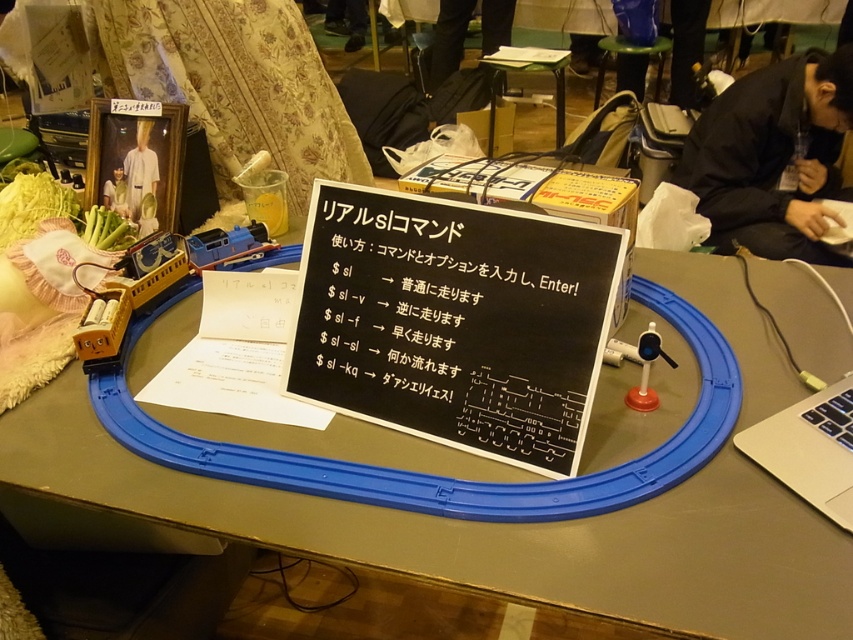
Does white fabric at center appear on the right side of matte white shirt at upper left?

Yes, white fabric at center is to the right of matte white shirt at upper left.

What do you see at coordinates (140, 172) in the screenshot? I see `white fabric at center` at bounding box center [140, 172].

The width and height of the screenshot is (853, 640). What do you see at coordinates (140, 172) in the screenshot? I see `white fabric at center` at bounding box center [140, 172].

The image size is (853, 640). I want to click on white fabric at center, so click(x=140, y=172).

Does black fabric at upper right come behind black pants at upper center?

No, it is not.

Find the location of a particular element. The image size is (853, 640). black fabric at upper right is located at coordinates (773, 156).

I want to click on black fabric at upper right, so click(773, 156).

Can you confirm if black pants at upper center is thinner than matte white shirt at upper left?

No.

Who is positioned more to the right, black pants at upper center or matte white shirt at upper left?

From the viewer's perspective, black pants at upper center appears more on the right side.

At what (x,y) coordinates should I click in order to perform the action: click on black pants at upper center. Please return your answer as a coordinate pair (x, y). This screenshot has height=640, width=853. Looking at the image, I should click on (448, 38).

This screenshot has width=853, height=640. In order to click on black pants at upper center in this screenshot , I will do `click(448, 38)`.